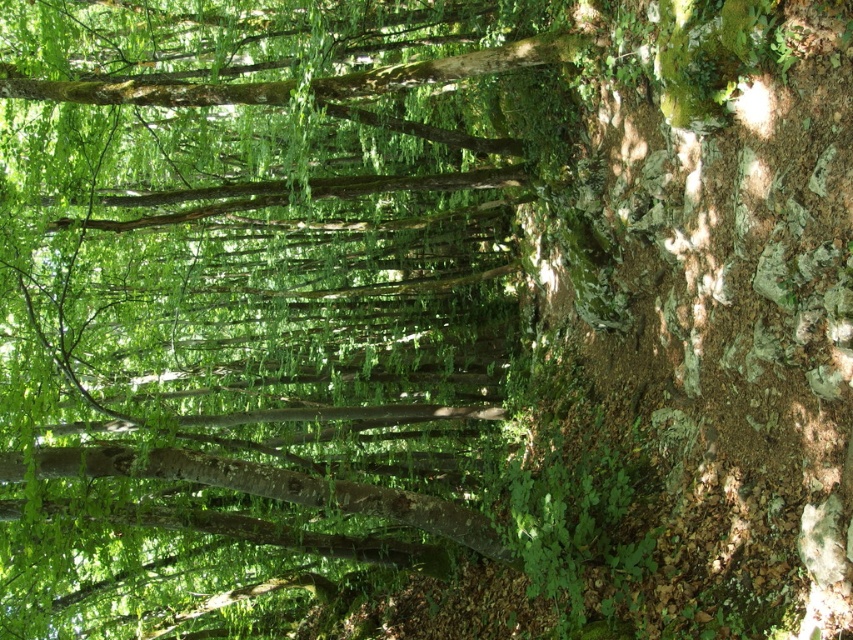
Question: From the image, what is the correct spatial relationship of green leafy tree at center in relation to smooth brown tree trunk at center?

Choices:
 (A) left
 (B) right

Answer: (A)

Question: Is green leafy tree at center smaller than smooth brown tree trunk at center?

Choices:
 (A) no
 (B) yes

Answer: (A)

Question: Which of the following is the closest to the observer?

Choices:
 (A) smooth brown tree trunk at center
 (B) green leafy tree at center

Answer: (B)

Question: Is the position of green leafy tree at center less distant than that of smooth brown tree trunk at center?

Choices:
 (A) yes
 (B) no

Answer: (A)